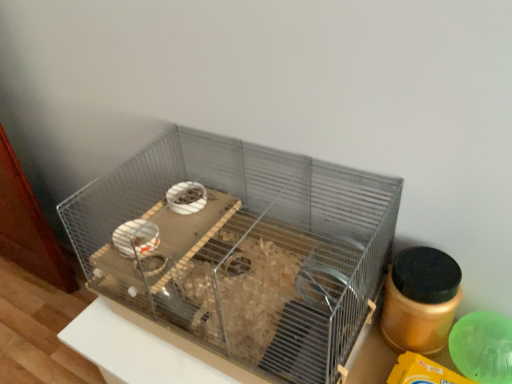
Question: Should I look upward or downward to see gold matte jar at right?

Choices:
 (A) down
 (B) up

Answer: (A)

Question: Is gold matte jar at right taller than metal wire bird cage at center?

Choices:
 (A) no
 (B) yes

Answer: (A)

Question: Can you confirm if gold matte jar at right is shorter than metal wire bird cage at center?

Choices:
 (A) yes
 (B) no

Answer: (A)

Question: Is gold matte jar at right not close to metal wire bird cage at center?

Choices:
 (A) no
 (B) yes

Answer: (A)

Question: Can you confirm if gold matte jar at right is positioned to the left of metal wire bird cage at center?

Choices:
 (A) yes
 (B) no

Answer: (B)

Question: Is gold matte jar at right at the right side of metal wire bird cage at center?

Choices:
 (A) no
 (B) yes

Answer: (B)

Question: Is gold matte jar at right not inside metal wire bird cage at center?

Choices:
 (A) yes
 (B) no

Answer: (A)

Question: From a real-world perspective, does metal wire bird cage at center stand above gold matte jar at right?

Choices:
 (A) yes
 (B) no

Answer: (A)

Question: Is there a large distance between metal wire bird cage at center and gold matte jar at right?

Choices:
 (A) no
 (B) yes

Answer: (A)

Question: From the image's perspective, is metal wire bird cage at center under gold matte jar at right?

Choices:
 (A) yes
 (B) no

Answer: (B)

Question: Would you say metal wire bird cage at center is outside gold matte jar at right?

Choices:
 (A) no
 (B) yes

Answer: (B)

Question: Is metal wire bird cage at center placed right next to gold matte jar at right?

Choices:
 (A) yes
 (B) no

Answer: (B)

Question: Does metal wire bird cage at center have a smaller size compared to gold matte jar at right?

Choices:
 (A) no
 (B) yes

Answer: (A)

Question: Is gold matte jar at right inside the boundaries of metal wire bird cage at center, or outside?

Choices:
 (A) inside
 (B) outside

Answer: (B)